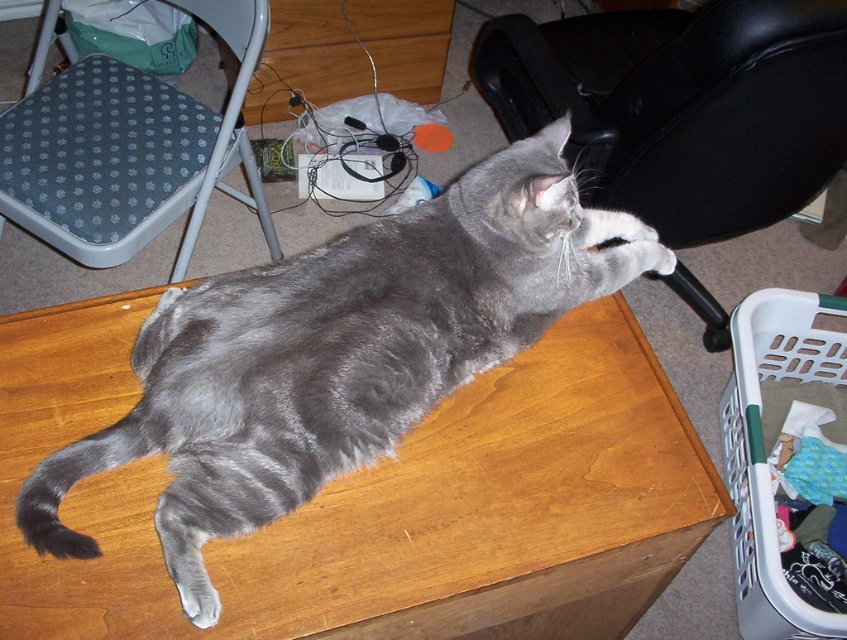
How much distance is there between black leather swivel chair at upper right and metallic gray swivel chair at upper left?

25.49 inches

Is point (770, 202) farther from viewer compared to point (142, 76)?

No, (770, 202) is closer to viewer.

The width and height of the screenshot is (847, 640). I want to click on black leather swivel chair at upper right, so click(681, 106).

Does black leather swivel chair at upper right have a greater height compared to white plastic laundry basket at lower right?

Yes, black leather swivel chair at upper right is taller than white plastic laundry basket at lower right.

Does black leather swivel chair at upper right have a larger size compared to white plastic laundry basket at lower right?

Yes, black leather swivel chair at upper right is bigger than white plastic laundry basket at lower right.

This screenshot has width=847, height=640. Describe the element at coordinates (681, 106) in the screenshot. I see `black leather swivel chair at upper right` at that location.

Find the location of a particular element. This screenshot has height=640, width=847. black leather swivel chair at upper right is located at coordinates (681, 106).

Does point (424, 218) come behind point (580, 52)?

No.

Is gray soft fur cat at center below black leather swivel chair at upper right?

Indeed, gray soft fur cat at center is positioned under black leather swivel chair at upper right.

Does point (195, 296) come behind point (615, 20)?

No, (195, 296) is closer to viewer.

You are a GUI agent. You are given a task and a screenshot of the screen. Output one action in this format:
    pyautogui.click(x=<x>, y=<y>)
    Task: Click on the gray soft fur cat at center
    Image resolution: width=847 pixels, height=640 pixels.
    Given the screenshot: What is the action you would take?
    pyautogui.click(x=340, y=353)